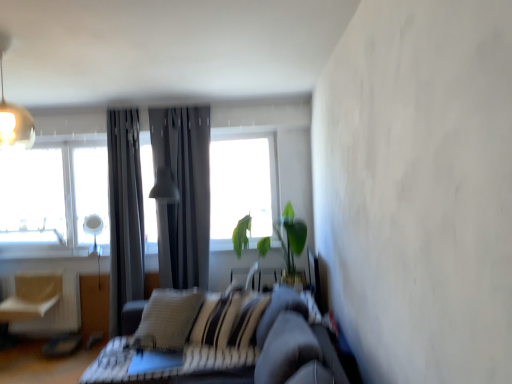
Question: From the image's perspective, relative to green leafy plant at center, is matte gray lampshade at center, acting as the 1th light fixture starting from the bottom, above or below?

Choices:
 (A) below
 (B) above

Answer: (B)

Question: Is point (174, 246) positioned closer to the camera than point (291, 210)?

Choices:
 (A) farther
 (B) closer

Answer: (B)

Question: Which is farther from the metallic pendant light at upper left, which is counted as the 1th light fixture, starting from the top?

Choices:
 (A) green leafy plant at center
 (B) transparent glass window at upper left
 (C) light beige fabric swivel chair at left
 (D) matte gray lampshade at center, acting as the 1th light fixture starting from the bottom
 (E) dark gray fabric curtain at center

Answer: (A)

Question: Which object is the closest to the green leafy plant at center?

Choices:
 (A) transparent glass window at upper left
 (B) dark gray leather couch at center
 (C) light beige fabric swivel chair at left
 (D) matte gray lampshade at center, the first light fixture from the right
 (E) metallic pendant light at upper left, which appears as the 1th light fixture when viewed from the front

Answer: (D)